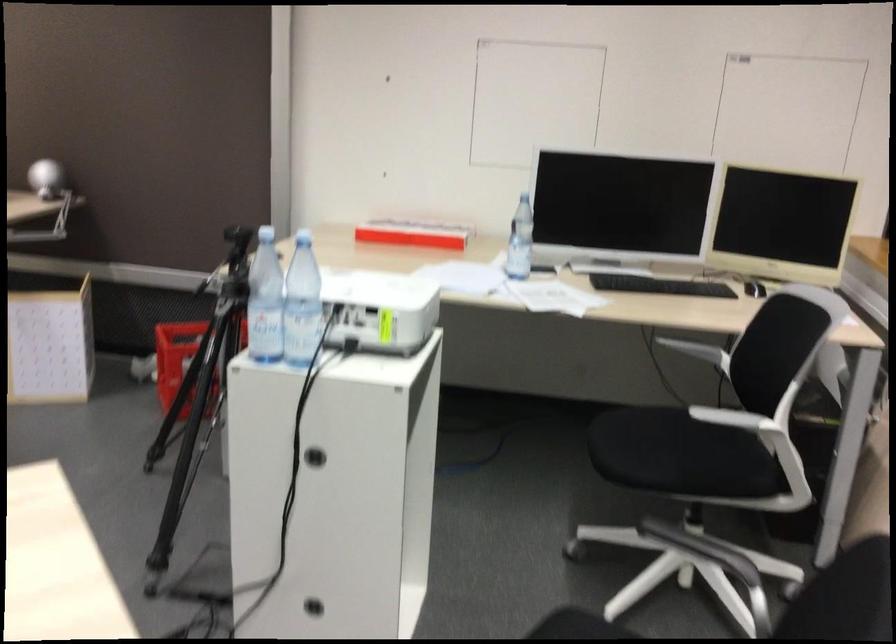
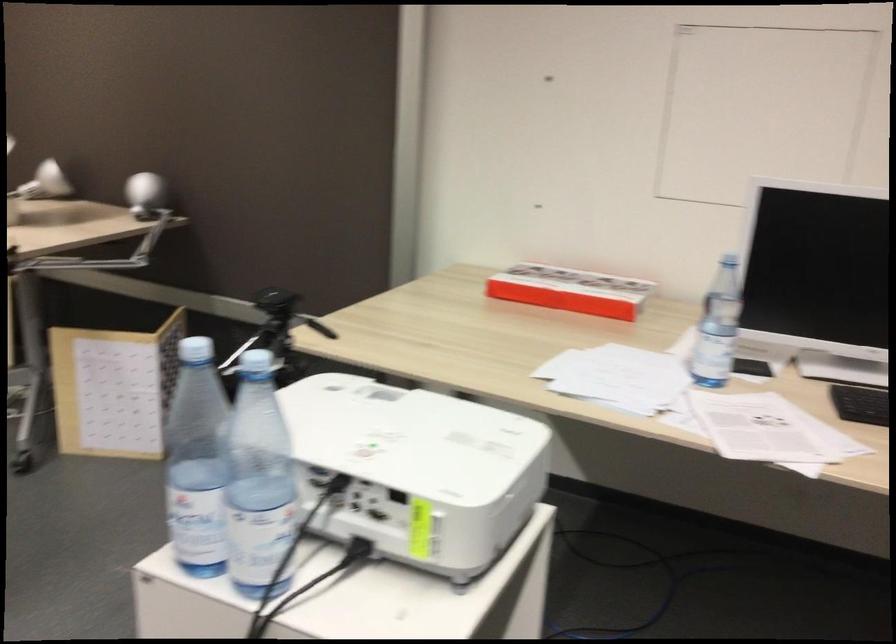
Find the pixel in the second image that matches (x=416, y=232) in the first image.

(570, 290)